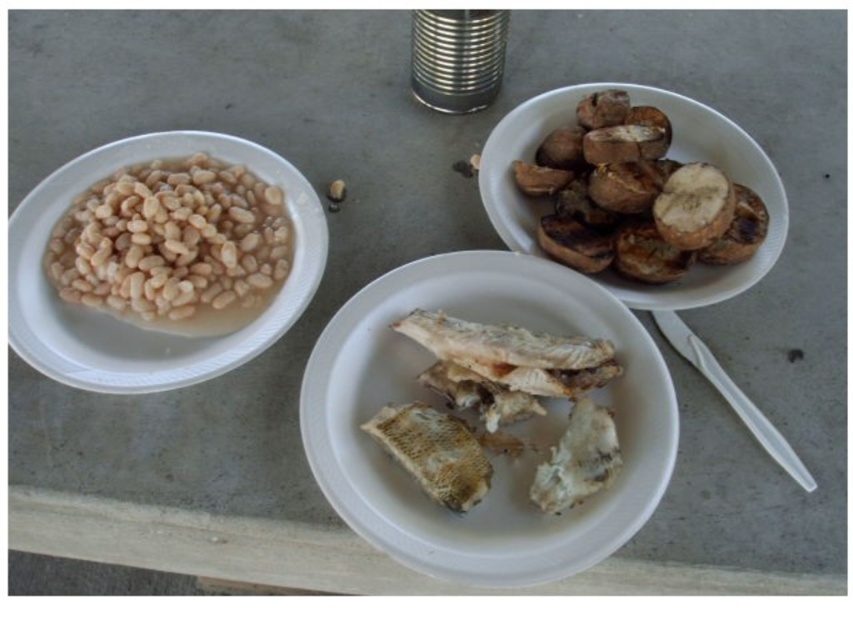
Question: Is white matte plate at center to the right of brown matte mushrooms at upper right from the viewer's perspective?

Choices:
 (A) no
 (B) yes

Answer: (A)

Question: Among these objects, which one is nearest to the camera?

Choices:
 (A) brown matte mushrooms at upper right
 (B) white plastic fork at lower right
 (C) matte brown nut at center
 (D) white matte plate at left

Answer: (B)

Question: Which of the following is the closest to the observer?

Choices:
 (A) (749, 400)
 (B) (706, 198)
 (C) (521, 424)
 (D) (598, 483)

Answer: (D)

Question: Does white matte plate at center lie behind white matte plate at left?

Choices:
 (A) yes
 (B) no

Answer: (B)

Question: Based on their relative distances, which object is farther from the brown crispy fish at center?

Choices:
 (A) white plastic fork at lower right
 (B) white matte plate at center
 (C) matte brown nut at center
 (D) white matte plate at left

Answer: (C)

Question: Is white matte plate at left to the left of white plastic fork at lower right from the viewer's perspective?

Choices:
 (A) no
 (B) yes

Answer: (B)